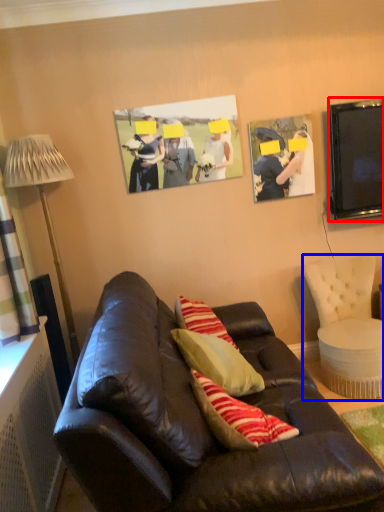
Question: Which object is closer to the camera taking this photo, television (highlighted by a red box) or chair (highlighted by a blue box)?

Choices:
 (A) television
 (B) chair

Answer: (B)